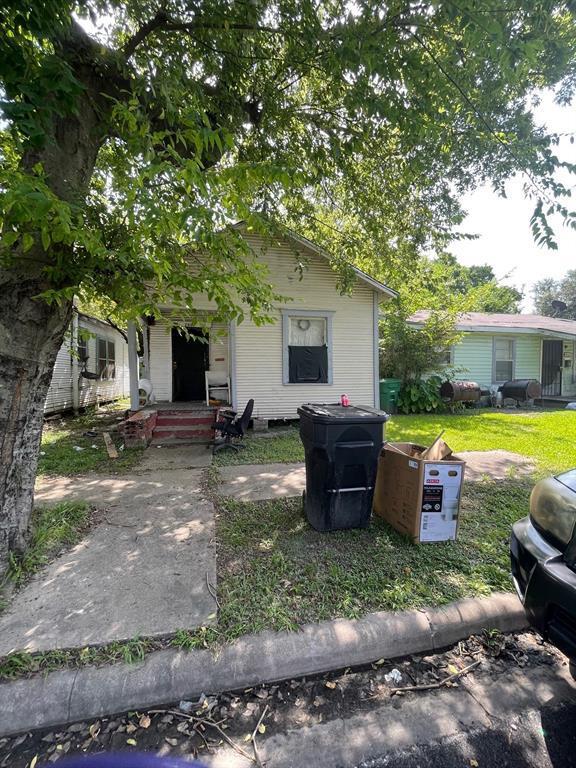
The height and width of the screenshot is (768, 576). Find the location of `chair`. chair is located at coordinates (242, 425).